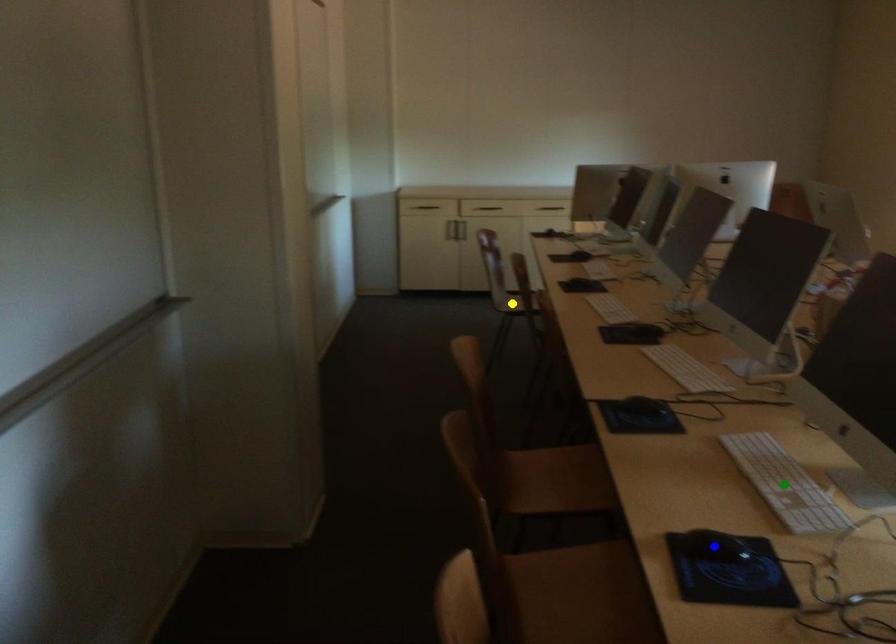
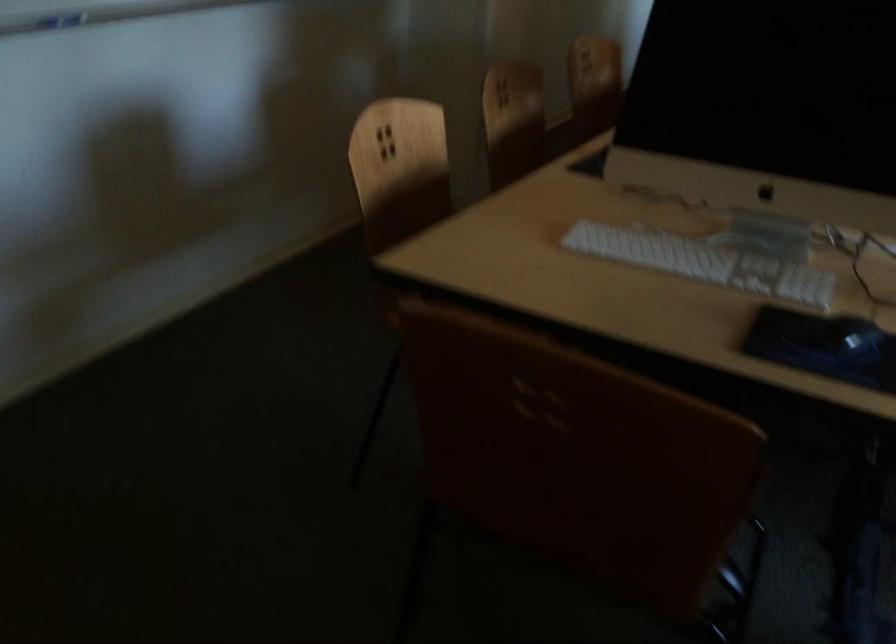
I am providing you with two images of the same scene from different viewpoints. Three points are marked in image1. Which point corresponds to a part or object that is occluded in image2?In image1, three points are marked. Which of them correspond to a part or object that is occluded in image2?Among the three points shown in image1, which one corresponds to a part or object that is no longer visible due to occlusion in image2?

blue point, yellow point, green point cannot be seen in image2.